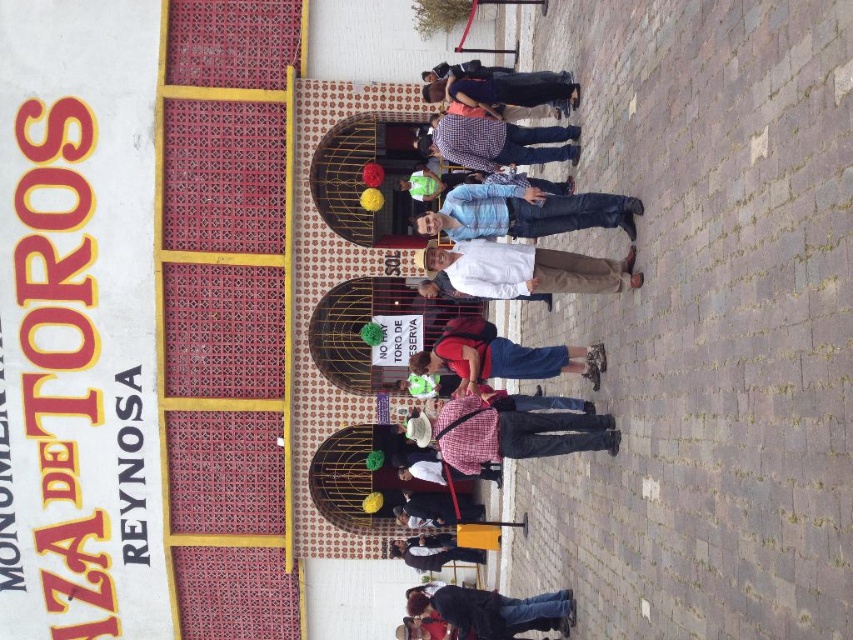
Question: Is plaid shirt at center to the right of blue striped shirt at center from the viewer's perspective?

Choices:
 (A) yes
 (B) no

Answer: (A)

Question: Observing the image, what is the correct spatial positioning of blue striped shirt at center in reference to white matte shirt at center?

Choices:
 (A) right
 (B) left

Answer: (B)

Question: Among these points, which one is nearest to the camera?

Choices:
 (A) (550, 125)
 (B) (494, 433)
 (C) (577, 364)
 (D) (440, 544)

Answer: (B)

Question: Does white matte shirt at center have a greater width compared to red fabric backpack at center?

Choices:
 (A) yes
 (B) no

Answer: (B)

Question: Estimate the real-world distances between objects in this image. Which object is closer to the white matte shirt at center?

Choices:
 (A) dark blue jeans at lower center
 (B) plaid shirt at center
 (C) checkered fabric shirt at center

Answer: (B)

Question: Among these objects, which one is nearest to the camera?

Choices:
 (A) plaid shirt at center
 (B) blue striped shirt at center

Answer: (B)